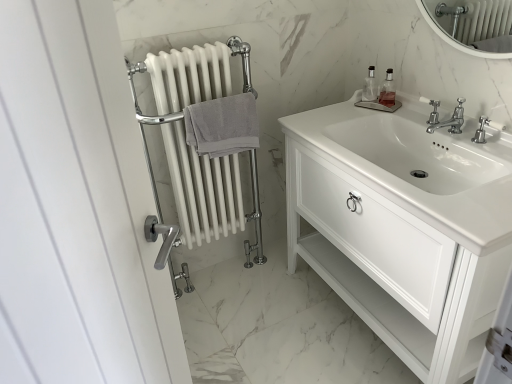
Question: Should I look upward or downward to see clear glass soap dispenser at upper right, placed as the second soap dispenser when sorted from right to left?

Choices:
 (A) up
 (B) down

Answer: (A)

Question: Is gray cotton towel at center-left wider than polished chrome faucet at center?

Choices:
 (A) yes
 (B) no

Answer: (B)

Question: Does gray cotton towel at center-left appear on the left side of polished chrome faucet at center?

Choices:
 (A) yes
 (B) no

Answer: (A)

Question: From a real-world perspective, is gray cotton towel at center-left on top of polished chrome faucet at center?

Choices:
 (A) no
 (B) yes

Answer: (A)

Question: Is gray cotton towel at center-left facing away from polished chrome faucet at center?

Choices:
 (A) no
 (B) yes

Answer: (A)

Question: From the image's perspective, would you say gray cotton towel at center-left is shown under polished chrome faucet at center?

Choices:
 (A) no
 (B) yes

Answer: (B)

Question: From the image's perspective, is gray cotton towel at center-left over polished chrome faucet at center?

Choices:
 (A) yes
 (B) no

Answer: (B)

Question: From a real-world perspective, does gray cotton towel at center-left sit lower than clear glass soap dispenser at upper right, arranged as the 2th soap dispenser when viewed from the left?

Choices:
 (A) no
 (B) yes

Answer: (B)

Question: Are gray cotton towel at center-left and clear glass soap dispenser at upper right, arranged as the 2th soap dispenser when viewed from the left, located far from each other?

Choices:
 (A) yes
 (B) no

Answer: (B)

Question: Is gray cotton towel at center-left at the right side of clear glass soap dispenser at upper right, which ranks as the first soap dispenser in right-to-left order?

Choices:
 (A) no
 (B) yes

Answer: (A)

Question: From the image's perspective, would you say gray cotton towel at center-left is shown under clear glass soap dispenser at upper right, which ranks as the first soap dispenser in right-to-left order?

Choices:
 (A) no
 (B) yes

Answer: (B)

Question: Is clear glass soap dispenser at upper right, arranged as the 2th soap dispenser when viewed from the left, a part of gray cotton towel at center-left?

Choices:
 (A) no
 (B) yes

Answer: (A)

Question: From a real-world perspective, is gray cotton towel at center-left located higher than clear glass soap dispenser at upper right, arranged as the 2th soap dispenser when viewed from the left?

Choices:
 (A) no
 (B) yes

Answer: (A)

Question: From a real-world perspective, is clear glass soap dispenser at upper right, which ranks as the first soap dispenser in right-to-left order, over gray cotton towel at center-left?

Choices:
 (A) yes
 (B) no

Answer: (A)